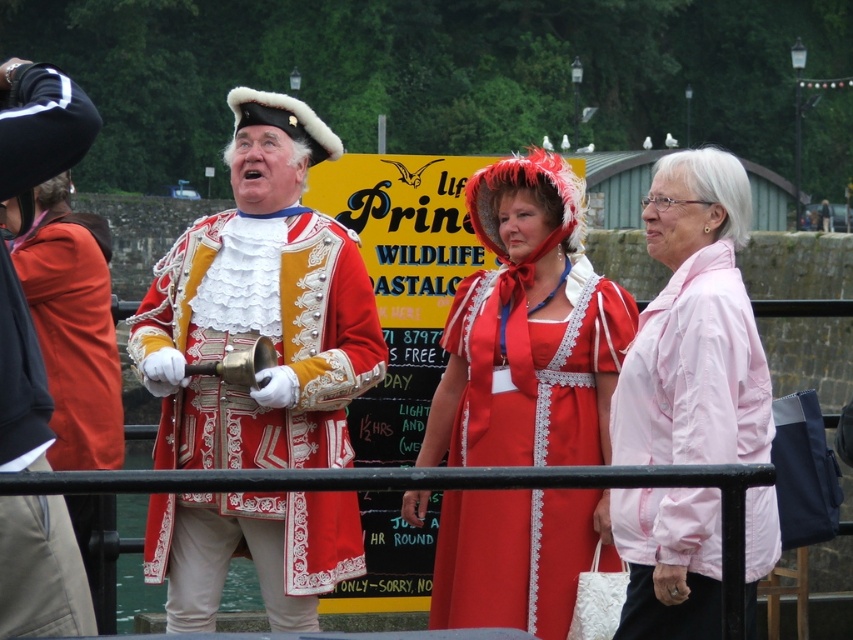
Based on the photo, you are a costume designer observing the scene. You need to determine which costume requires more fabric between the matte gold and red coat at center and the matte gold jacket at center. Which one would need more fabric?

The matte gold and red coat at center requires more fabric because it is bigger than the matte gold jacket at center.

In the scene shown: You are a photographer trying to capture the best angle of the scene. You notice two points marked in the image at coordinates point (x=500, y=285) and point (x=740, y=195). Which point is closer to your camera lens?

Point (x=500, y=285) is further to the camera than point (x=740, y=195). Wait, the description says the first point is further than the second, so the answer should be that point (x=740, y=195) is closer to the camera because it is less further away. Hmm, maybe rephrase. The Objects Description states that point (x=500, y=285) is further to the viewer than point (x=740, y=195). Therefore, point (x=740, y=195) is closer to the camera lens.

You are an event planner arranging a photo shoot and need to position the matte red dress at center and the white silky wig at upper right in a way that maintains their current spatial relationship. Which object should be placed closer to the camera to ensure the correct size perception?

The matte red dress at center should be placed closer to the camera since it has a lesser width compared to the white silky wig at upper right, which would make it appear larger when positioned nearer, maintaining their size relationship as in the original scene.